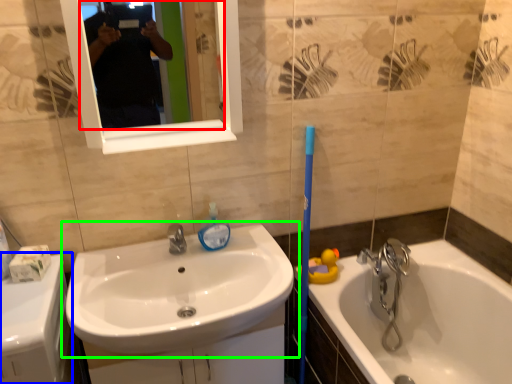
Question: Which object is the farthest from mirror (highlighted by a red box)? Choose among these: counter top (highlighted by a blue box) or sink (highlighted by a green box).

Choices:
 (A) counter top
 (B) sink

Answer: (A)